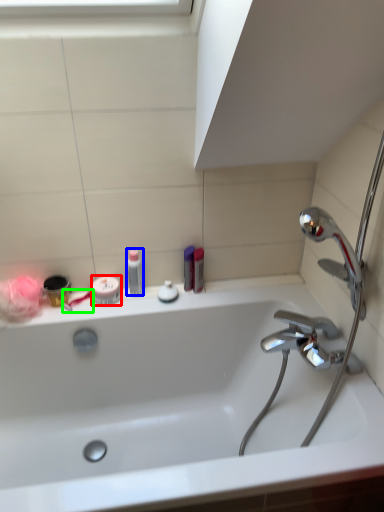
Question: Which object is the farthest from mouthwash (highlighted by a red box)? Choose among these: toiletry (highlighted by a blue box) or toothbrush (highlighted by a green box).

Choices:
 (A) toiletry
 (B) toothbrush

Answer: (A)